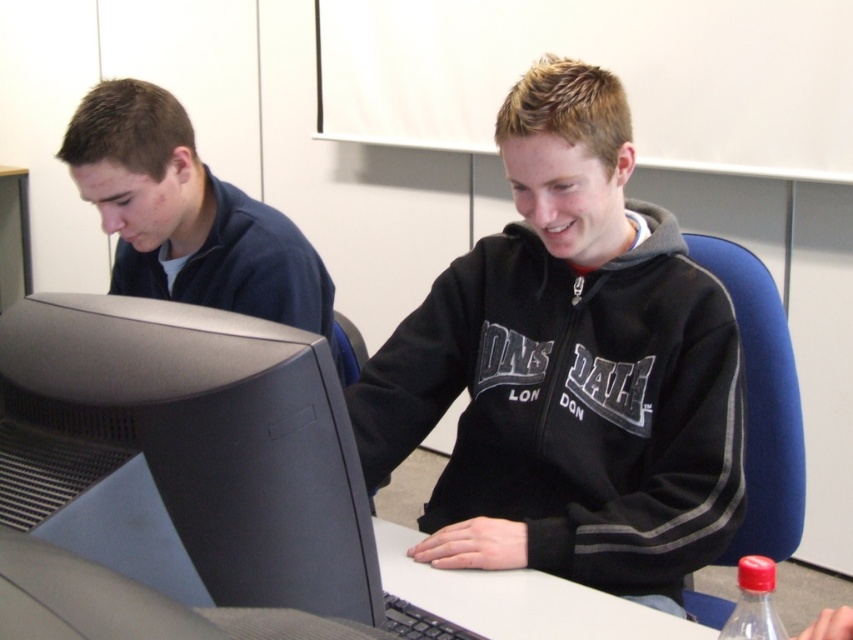
Question: Does black matte computer monitor at left come behind red plastic bottle at lower right?

Choices:
 (A) yes
 (B) no

Answer: (B)

Question: Which object appears closest to the camera in this image?

Choices:
 (A) matte blue shirt at left
 (B) black fleece sweatshirt at center
 (C) red plastic bottle at lower right
 (D) black matte computer monitor at left

Answer: (D)

Question: Where is black matte computer monitor at left located in relation to matte blue shirt at left in the image?

Choices:
 (A) left
 (B) right

Answer: (B)

Question: Where is black fleece sweatshirt at center located in relation to matte blue shirt at left in the image?

Choices:
 (A) above
 (B) below

Answer: (B)

Question: Which is farther from the black matte computer monitor at left?

Choices:
 (A) matte blue shirt at left
 (B) red plastic bottle at lower right
 (C) black fleece sweatshirt at center

Answer: (A)

Question: Which point is closer to the camera taking this photo?

Choices:
 (A) (138, 132)
 (B) (602, 538)
 (C) (206, 522)
 (D) (763, 625)

Answer: (C)